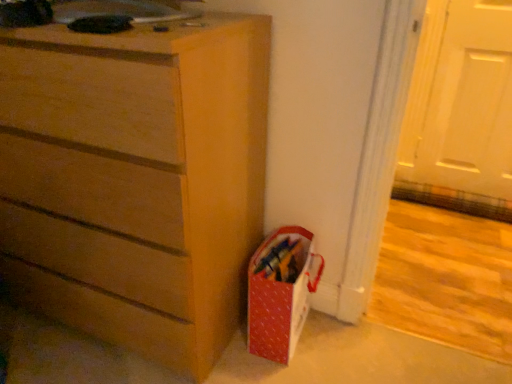
Where is `unoccupied region to the right of matte red gift bag at lower right`? The height and width of the screenshot is (384, 512). unoccupied region to the right of matte red gift bag at lower right is located at coordinates (342, 340).